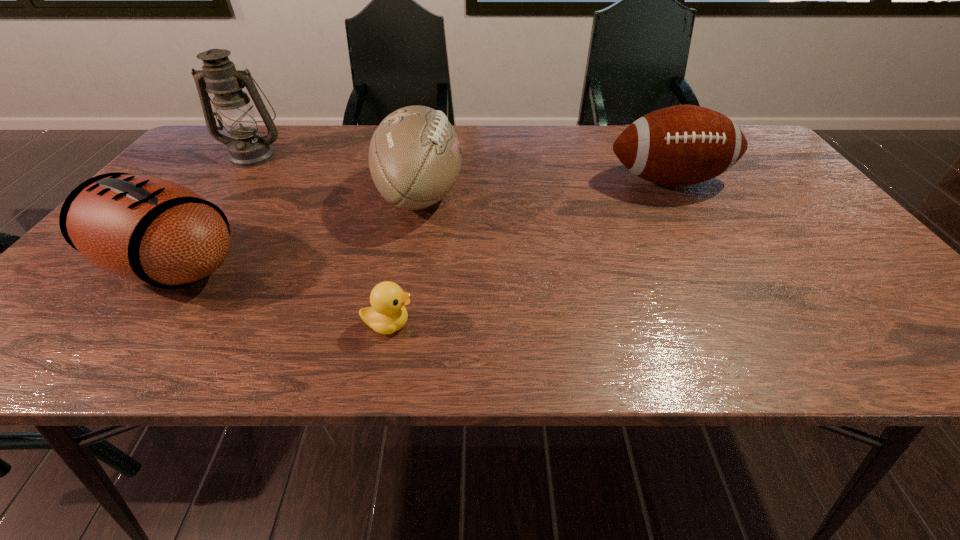
Find the location of `oil lamp`. oil lamp is located at coordinates (235, 113).

Locate an element on the screen. the second football (American) from left to right is located at coordinates (414, 157).

At what (x,y) coordinates should I click in order to perform the action: click on the rightmost object. Please return your answer as a coordinate pair (x, y). The image size is (960, 540). Looking at the image, I should click on (681, 145).

The width and height of the screenshot is (960, 540). Identify the location of the leftmost football (American). (144, 229).

I want to click on duck, so click(388, 314).

Find the location of `free region located 0.260m on the front of the oil lamp`. free region located 0.260m on the front of the oil lamp is located at coordinates (202, 225).

Identify the location of vacant space positioned on the laces of the second football (American) from right to left. (502, 195).

Where is `free space located on the laces of the rightmost football (American)`? This screenshot has height=540, width=960. free space located on the laces of the rightmost football (American) is located at coordinates (698, 232).

You are a GUI agent. You are given a task and a screenshot of the screen. Output one action in this format:
    pyautogui.click(x=<x>, y=<y>)
    Task: Click on the vacant area situated 0.320m on the back of the leftmost football (American)
    This screenshot has width=960, height=540.
    Given the screenshot: What is the action you would take?
    pyautogui.click(x=252, y=159)

Identify the location of free location located on the face of the duck. (620, 324).